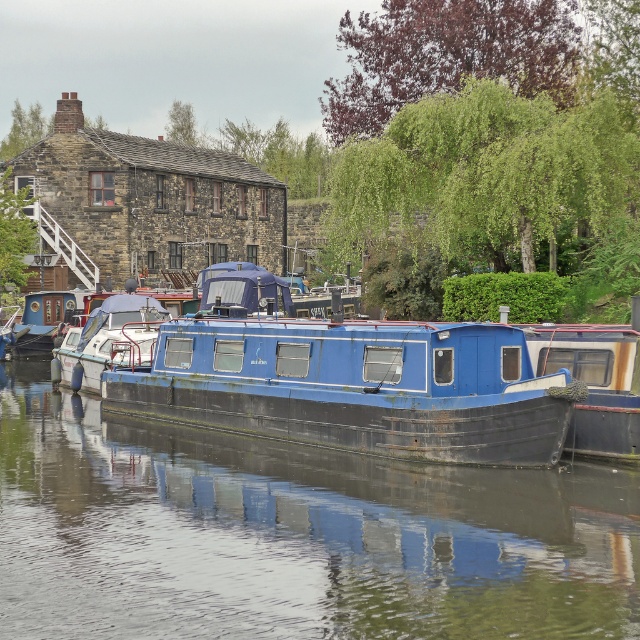
Question: Observing the image, what is the correct spatial positioning of smooth dark blue boat at center in reference to blue painted wood boat at center?

Choices:
 (A) left
 (B) right

Answer: (A)

Question: Is smooth dark blue boat at center thinner than blue painted wood boat at center?

Choices:
 (A) no
 (B) yes

Answer: (A)

Question: Estimate the real-world distances between objects in this image. Which object is farther from the blue painted wood boat at center?

Choices:
 (A) smooth dark blue boat at center
 (B) blue matte barge at center

Answer: (A)

Question: Which object is the farthest from the smooth dark blue boat at center?

Choices:
 (A) blue matte barge at center
 (B) blue painted wood boat at center

Answer: (B)

Question: Does blue matte barge at center appear on the right side of blue painted wood boat at center?

Choices:
 (A) yes
 (B) no

Answer: (B)

Question: Which object is the closest to the blue painted wood boat at center?

Choices:
 (A) smooth dark blue boat at center
 (B) blue matte barge at center

Answer: (B)